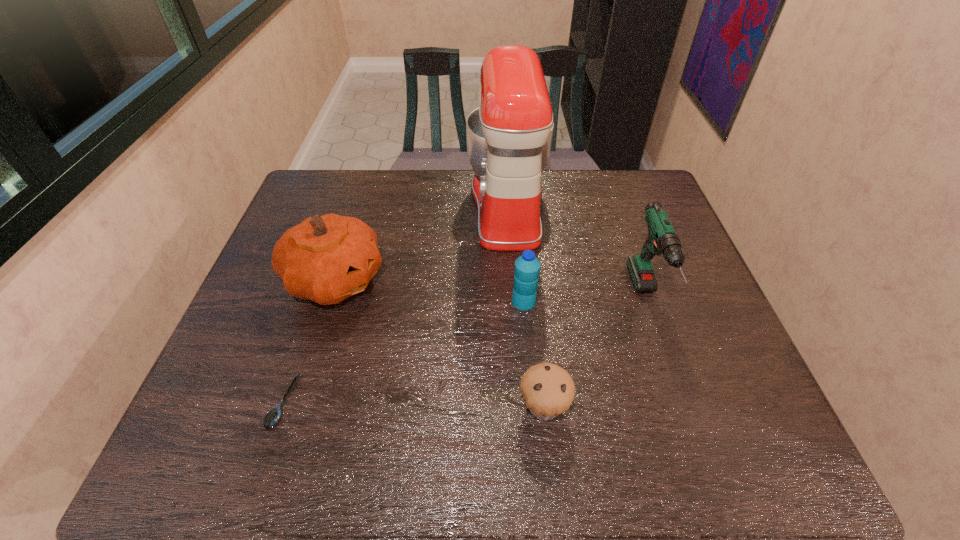
Locate an element on the screen. vacant area situated 0.350m on the front-facing side of the pumpkin is located at coordinates click(x=517, y=280).

Identify the location of vacant space located on the front of the third shortest object. Image resolution: width=960 pixels, height=540 pixels. (530, 369).

Locate an element on the screen. This screenshot has height=540, width=960. vacant space located 0.240m on the back of the fifth tallest object is located at coordinates [532, 300].

At what (x,y) coordinates should I click in order to perform the action: click on free space located 0.350m on the right of the shortest object. Please return your answer as a coordinate pair (x, y). Looking at the image, I should click on (462, 403).

Identify the location of object that is at the far edge. This screenshot has height=540, width=960. (509, 136).

Image resolution: width=960 pixels, height=540 pixels. What are the coordinates of `muffin positioned at the near edge` in the screenshot? It's located at (548, 390).

At what (x,y) coordinates should I click in order to perform the action: click on soupspoon located at the near edge. Please return your answer as a coordinate pair (x, y). Looking at the image, I should click on (274, 415).

The width and height of the screenshot is (960, 540). In order to click on pumpkin located at the left edge in this screenshot , I will do `click(326, 259)`.

The height and width of the screenshot is (540, 960). What are the coordinates of `soupspoon positioned at the left edge` in the screenshot? It's located at (274, 415).

What are the coordinates of `object located at the right edge` in the screenshot? It's located at (662, 238).